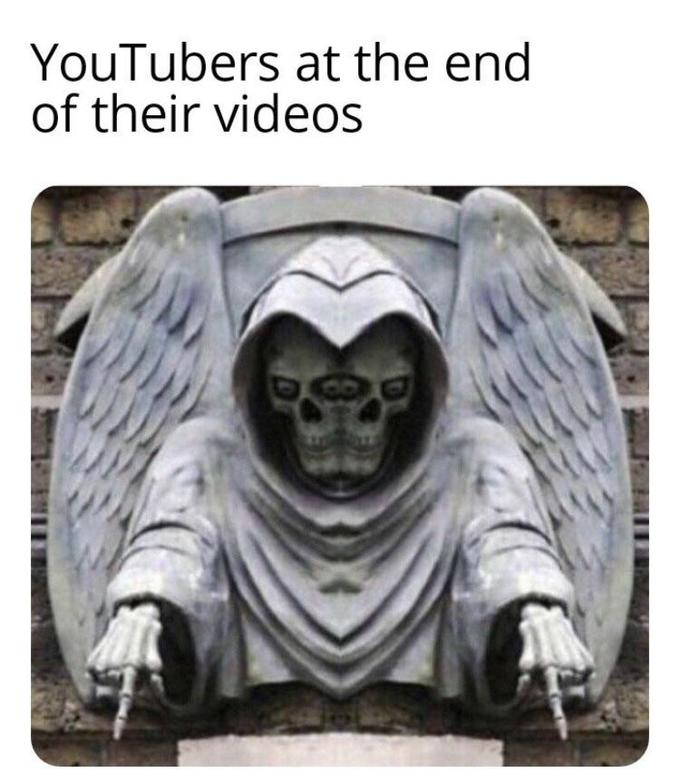
Where is `drape`? This screenshot has width=680, height=782. drape is located at coordinates (425, 655).